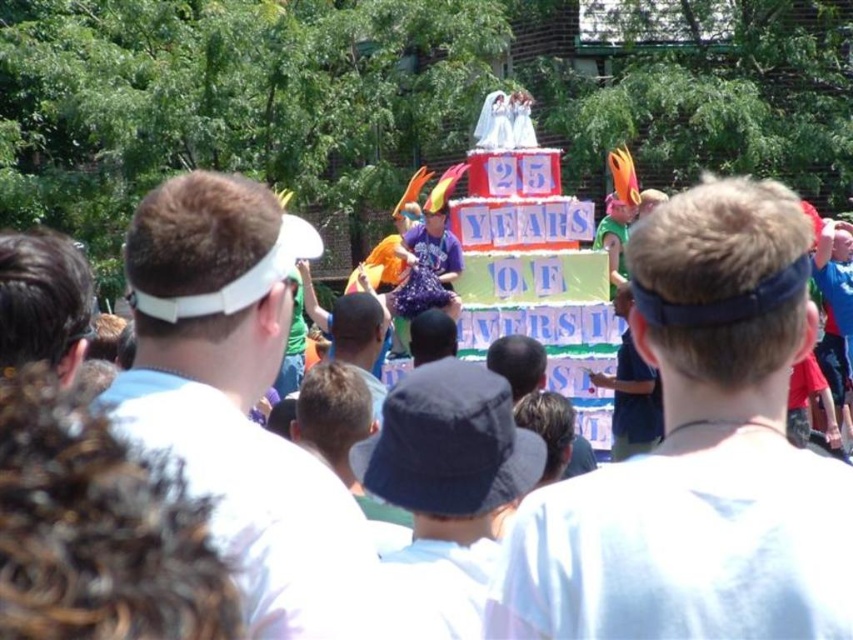
Based on the photo, you are a photographer trying to capture a clear shot of both the white fabric headband at center and the white visor at left. Based on their positions, which one should you focus on first to ensure both are in frame?

The white fabric headband at center is below the white visor at left, so you should focus on the white visor at left first to ensure both are in frame.

You are a photographer at the event and want to capture both the dark blue fabric bucket hat at center and the matte blue cap at center in a single photo. Which object should you position closer to the left side of your camera frame to ensure both are included?

Position the dark blue fabric bucket hat at center closer to the left side of your camera frame since it is already to the left of the matte blue cap at center, ensuring both fit within the frame.

Based on the photo, you are a photographer trying to capture both the white fabric headband at center and the white visor at left in a single frame. Which object should you adjust your camera focus to prioritize if you want to ensure the wider object is clearly visible?

The white fabric headband at center is wider than the white visor at left, so you should prioritize focusing on the white fabric headband at center to ensure its full width is captured clearly.